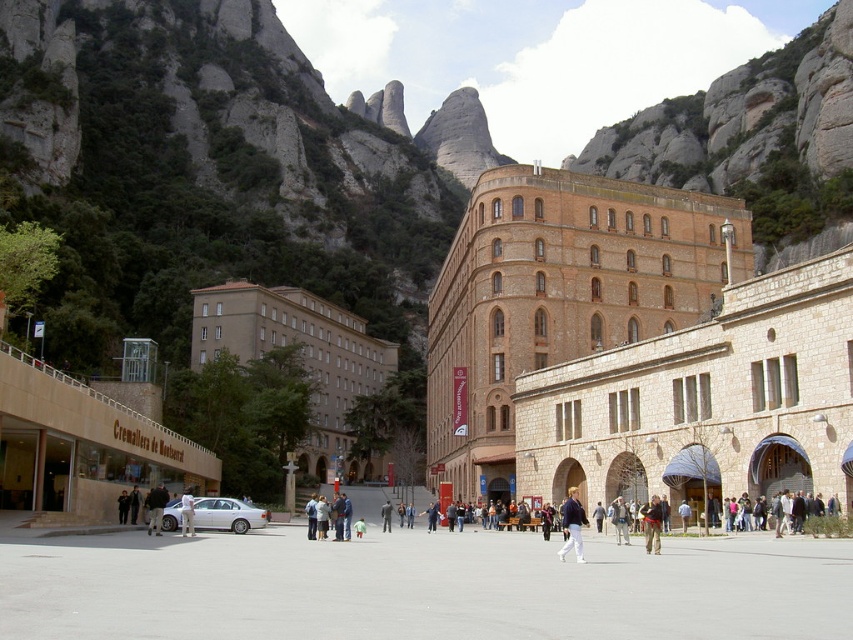
You are a tour guide leading a group through the plaza. You notice a white matte sedan at center and a khaki cotton pants at center. Which object is wider?

The white matte sedan at center is wider than the khaki cotton pants at center.

You are a tour guide leading a group of tourists. You notice a white matte sedan at center and khaki cotton pants at center in the plaza. Your group wants to take a photo where the sedan is in the background and the khaki cotton pants are in the foreground. Can you position them so that both are in the frame without moving either object? Explain how you would do this.

The white matte sedan at center is 21.57 meters away from the khaki cotton pants at center. To capture both in the frame, position the camera close to the khaki cotton pants at center and use a wide angle lens to include the sedan in the background while keeping the pants in the foreground. This setup ensures both objects remain in the frame without moving them.